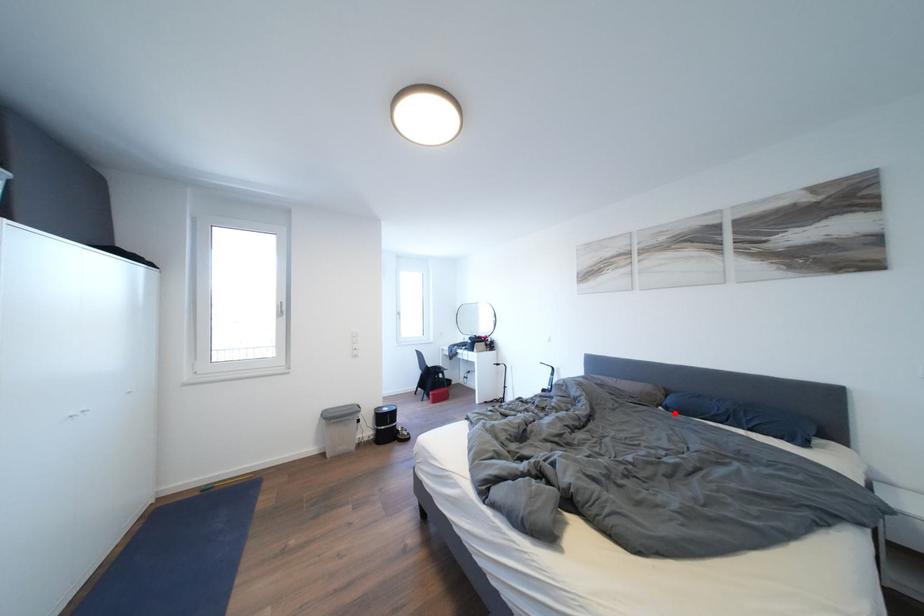
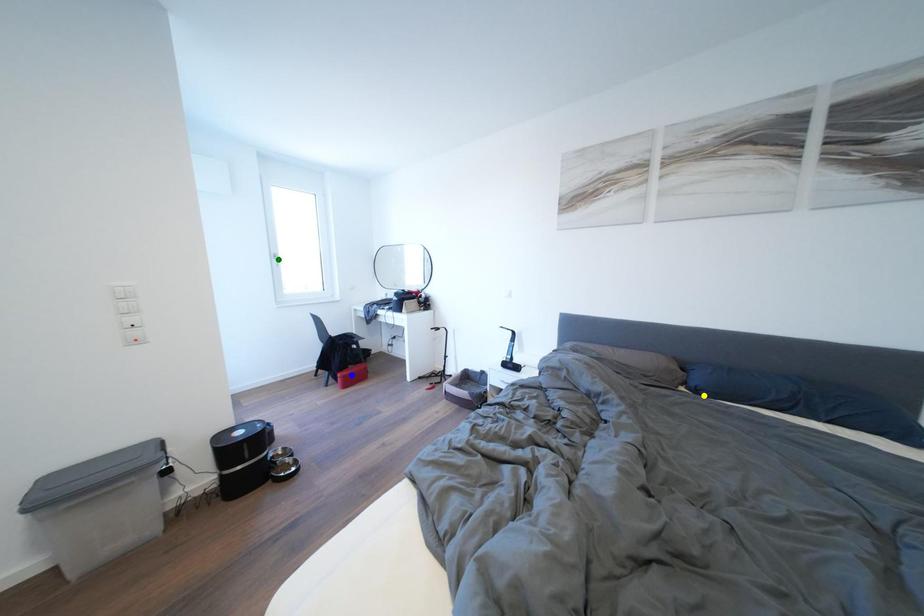
Question: I am providing you with two images of the same scene from different viewpoints. A red point is marked on the first image. You are given multiple points on the second image. Can you choose the point in image 2 that corresponds to the point in image 1?

Choices:
 (A) yellow point
 (B) blue point
 (C) green point

Answer: (A)